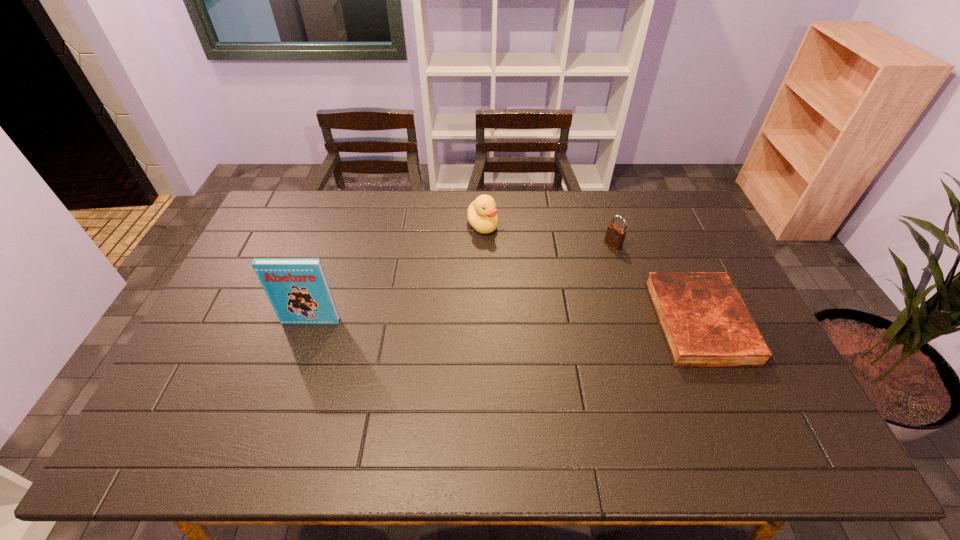
Where is `vacant space located at the beak of the second object from left to right`? This screenshot has width=960, height=540. vacant space located at the beak of the second object from left to right is located at coordinates (507, 267).

Locate an element on the screen. vacant space situated at the beak of the second object from left to right is located at coordinates (531, 307).

This screenshot has width=960, height=540. I want to click on free space located 0.390m on the front-facing side of the padlock, so click(531, 310).

Image resolution: width=960 pixels, height=540 pixels. In order to click on vacant space located 0.400m on the front-facing side of the padlock in this screenshot , I will do `click(529, 312)`.

The width and height of the screenshot is (960, 540). Identify the location of blank area located 0.120m on the front-facing side of the padlock. (587, 266).

Locate an element on the screen. The image size is (960, 540). object that is at the far edge is located at coordinates (482, 214).

Find the location of a particular element. object that is at the right edge is located at coordinates (705, 322).

Find the location of a particular element. free region at the far edge is located at coordinates (353, 193).

This screenshot has width=960, height=540. I want to click on vacant space at the near edge of the desktop, so click(717, 398).

In order to click on vacant space at the right edge in this screenshot , I will do `click(706, 246)`.